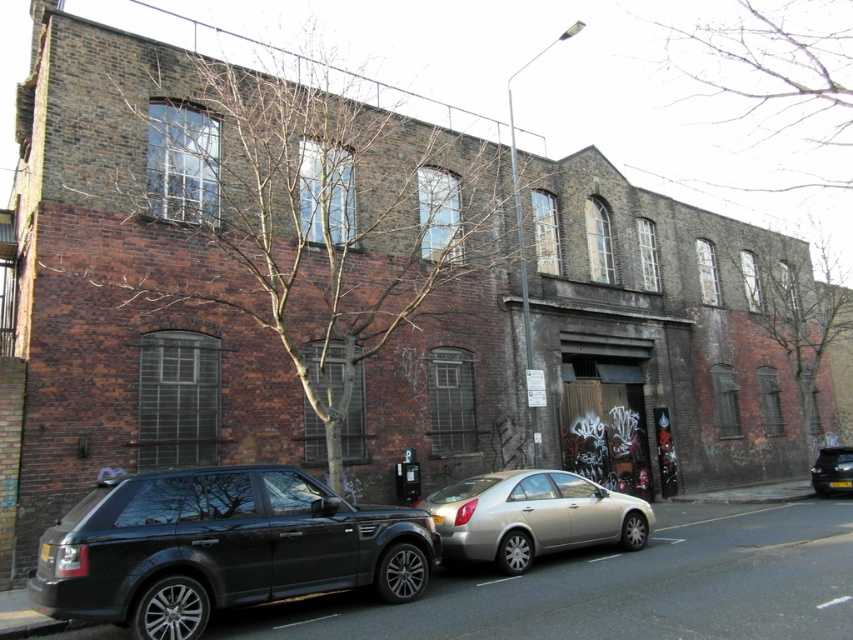
Is shiny black suv at lower left to the left of silver metallic sedan at center from the viewer's perspective?

Correct, you'll find shiny black suv at lower left to the left of silver metallic sedan at center.

Does shiny black suv at lower left appear over silver metallic sedan at center?

Indeed, shiny black suv at lower left is positioned over silver metallic sedan at center.

This screenshot has width=853, height=640. Find the location of `shiny black suv at lower left`. shiny black suv at lower left is located at coordinates [219, 547].

Which is above, silver metallic sedan at center or metallic silver sedan at lower right?

silver metallic sedan at center

Is silver metallic sedan at center positioned behind metallic silver sedan at lower right?

No.

Who is more distant from viewer, (547, 512) or (834, 476)?

The point (834, 476) is behind.

Locate an element on the screen. The image size is (853, 640). silver metallic sedan at center is located at coordinates (532, 516).

Between shiny black suv at lower left and metallic silver sedan at lower right, which one is positioned higher?

Positioned higher is shiny black suv at lower left.

Is shiny black suv at lower left shorter than metallic silver sedan at lower right?

No.

The height and width of the screenshot is (640, 853). Find the location of `shiny black suv at lower left`. shiny black suv at lower left is located at coordinates (219, 547).